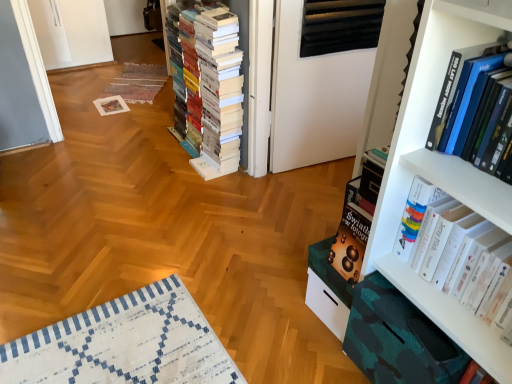
Question: Would you say white glossy book at right, positioned as the third book in left-to-right order, is to the left or to the right of white matte book at center, the first book viewed from the back, in the picture?

Choices:
 (A) right
 (B) left

Answer: (A)

Question: Considering their positions, is white glossy book at right, which ranks as the 1th book in right-to-left order, located in front of or behind white matte book at center, which appears as the third book when viewed from the front?

Choices:
 (A) behind
 (B) front

Answer: (B)

Question: Based on their relative distances, which object is farther from the white matte book at center, which appears as the third book when viewed from the front?

Choices:
 (A) white glossy book at right, the second book when ordered from back to front
 (B) hardcover book at upper right, the second book in the right-to-left sequence
 (C) white matte bookcase at right

Answer: (B)

Question: Which of these objects is positioned farthest from the white matte bookcase at right?

Choices:
 (A) white glossy book at right, which ranks as the 1th book in right-to-left order
 (B) white matte book at center, which appears as the third book when viewed from the front
 (C) hardcover book at upper right, acting as the 1th book starting from the front

Answer: (B)